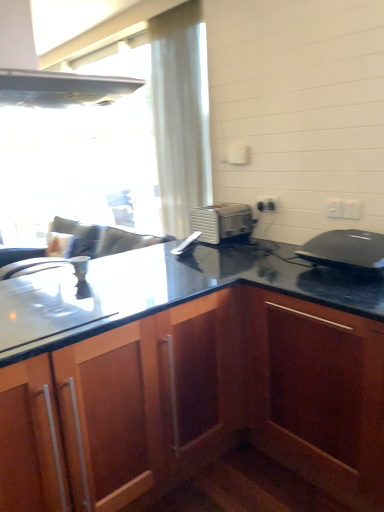
Question: Does point (342, 217) appear closer or farther from the camera than point (271, 209)?

Choices:
 (A) closer
 (B) farther

Answer: (A)

Question: From a real-world perspective, is white plastic electric outlet at upper right, the 1th electric outlet from the front, above or below white plastic electric outlet at upper right, acting as the 3th electric outlet starting from the front?

Choices:
 (A) below
 (B) above

Answer: (B)

Question: Estimate the real-world distances between objects in this image. Which object is farther from the wooden cabinet at lower left?

Choices:
 (A) white plastic electric outlet at upper right, acting as the 3th electric outlet starting from the front
 (B) white plastic electric outlet at upper right, which appears as the second electric outlet when viewed from the back
 (C) black matte laptop at upper right
 (D) white sheer curtain at upper left
 (E) white plastic toaster at center

Answer: (D)

Question: Considering the real-world distances, which object is farthest from the white plastic toaster at center?

Choices:
 (A) white plastic electric outlet at upper right, which appears as the second electric outlet when viewed from the back
 (B) white plastic electric outlet at upper right, acting as the third electric outlet starting from the back
 (C) black matte laptop at upper right
 (D) white plastic electric outlet at upper right, acting as the 3th electric outlet starting from the front
 (E) wooden cabinet at lower left

Answer: (E)